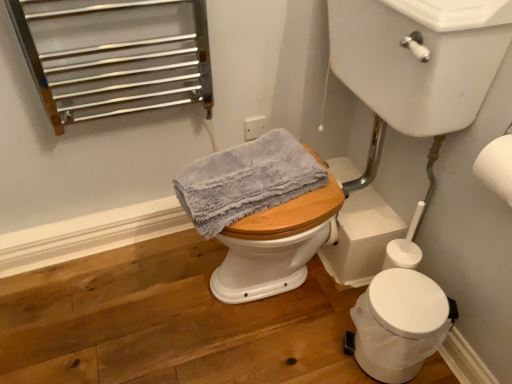
In order to click on vacant area situated to the left side of white plastic trash can at lower right in this screenshot , I will do `click(312, 343)`.